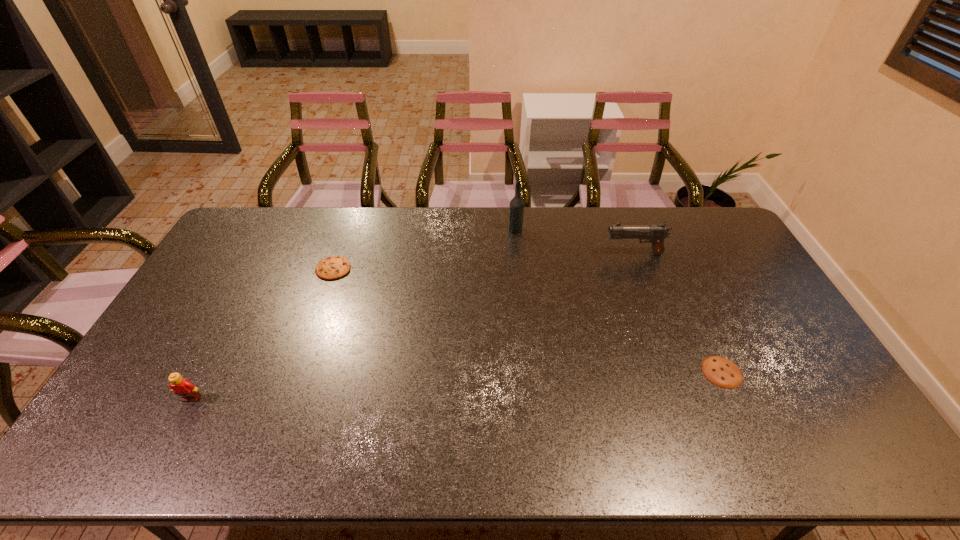
Where is `vacant space at the near edge of the desktop`? The image size is (960, 540). vacant space at the near edge of the desktop is located at coordinates (741, 457).

Locate an element on the screen. The width and height of the screenshot is (960, 540). free region at the left edge is located at coordinates (185, 311).

The image size is (960, 540). I want to click on free space at the right edge of the desktop, so click(736, 248).

You are a GUI agent. You are given a task and a screenshot of the screen. Output one action in this format:
    pyautogui.click(x=<x>, y=<y>)
    Task: Click on the free region at the far left corner
    The width and height of the screenshot is (960, 540).
    Given the screenshot: What is the action you would take?
    [255, 234]

This screenshot has height=540, width=960. In the image, there is a desktop. Identify the location of vacant area at the near right corner. (830, 443).

This screenshot has width=960, height=540. In order to click on vacant point located between the right cookie and the third tallest object in this screenshot , I will do `click(457, 386)`.

This screenshot has height=540, width=960. I want to click on free space between the farther cookie and the tallest object, so click(424, 249).

This screenshot has width=960, height=540. In order to click on empty space that is in between the farthest object and the fourth nearest object in this screenshot , I will do `click(574, 241)`.

Locate an element on the screen. Image resolution: width=960 pixels, height=540 pixels. empty location between the third tallest object and the vodka is located at coordinates 353,314.

At what (x,y) coordinates should I click in order to perform the action: click on vacant area between the shorter cookie and the third object from left to right. Please return your answer as a coordinate pair (x, y). The image size is (960, 540). Looking at the image, I should click on (618, 301).